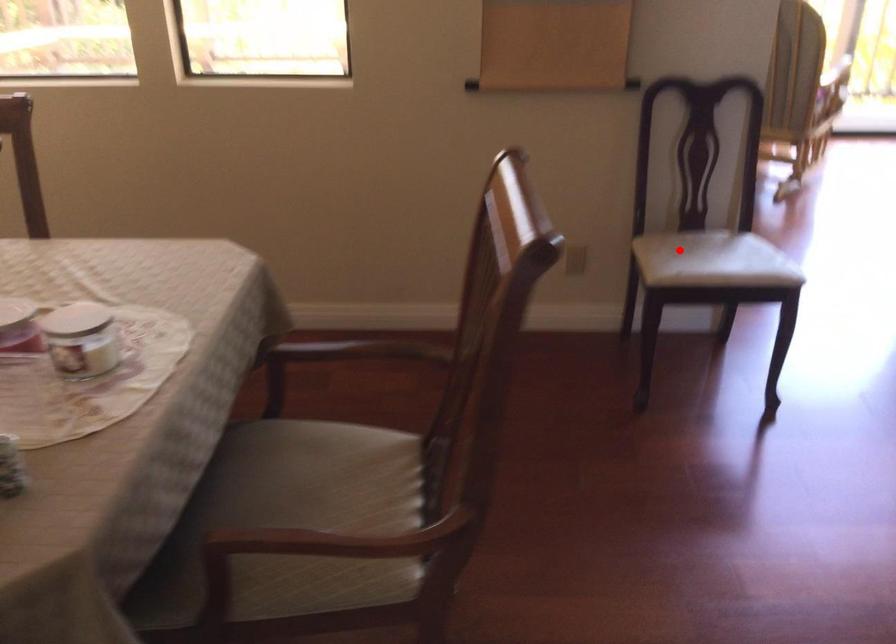
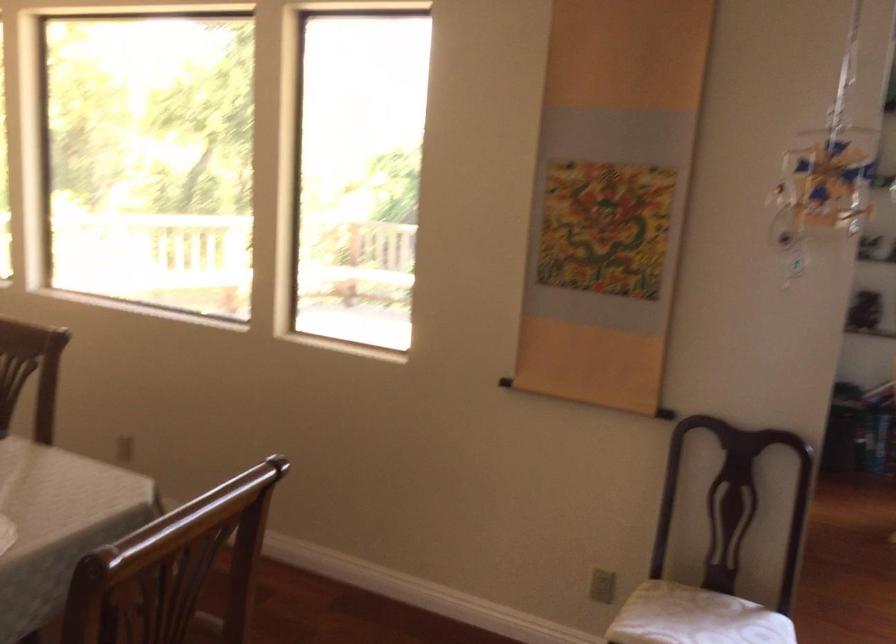
Question: A red point is marked in image1. In image2, is the corresponding 3D point closer to the camera or farther? Reply with the corresponding letter.

Choices:
 (A) The corresponding 3D point is closer.
 (B) The corresponding 3D point is farther.

Answer: (A)